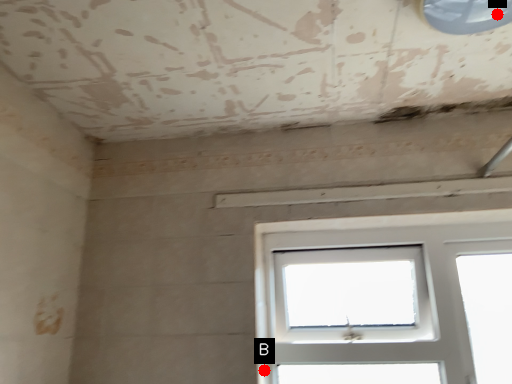
Question: Two points are circled on the image, labeled by A and B beside each circle. Which point is closer to the camera taking this photo?

Choices:
 (A) A is closer
 (B) B is closer

Answer: (A)